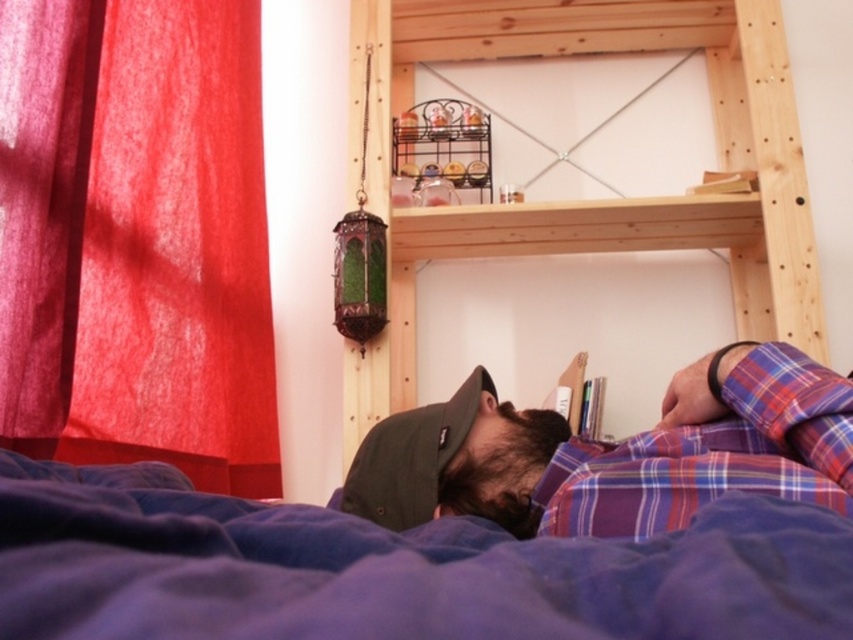
You are organizing a small gift basket and need to decide which item to place first. The blue soft blanket at lower center and the plaid fabric shirt at lower center are both in the basket. Which item should you place first based on their size?

The blue soft blanket at lower center is smaller than the plaid fabric shirt at lower center, so you should place the plaid fabric shirt at lower center first to accommodate the smaller item afterward.

You are standing in a bedroom and notice the wooden bunk bed at upper center and the green fabric cap at center. Which object is positioned higher in the room?

The wooden bunk bed at upper center is located above the green fabric cap at center, so it is positioned higher in the room.

You are a tailor trying to determine if the blue soft blanket at lower center can cover the plaid fabric shirt at lower center completely. Based on their sizes, is this possible?

The blue soft blanket at lower center might be wider than plaid fabric shirt at lower center, so it is possible that the blanket can cover the shirt completely if its width is sufficient.